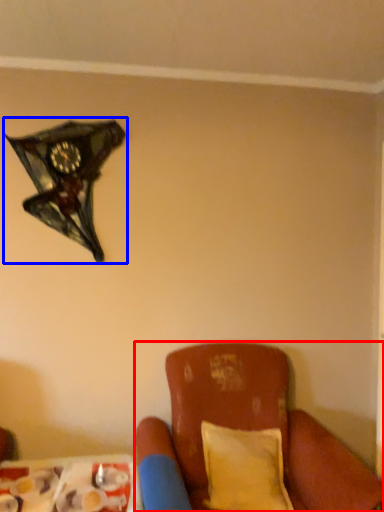
Question: Which point is further to the camera, furniture (highlighted by a red box) or lamp (highlighted by a blue box)?

Choices:
 (A) furniture
 (B) lamp

Answer: (B)